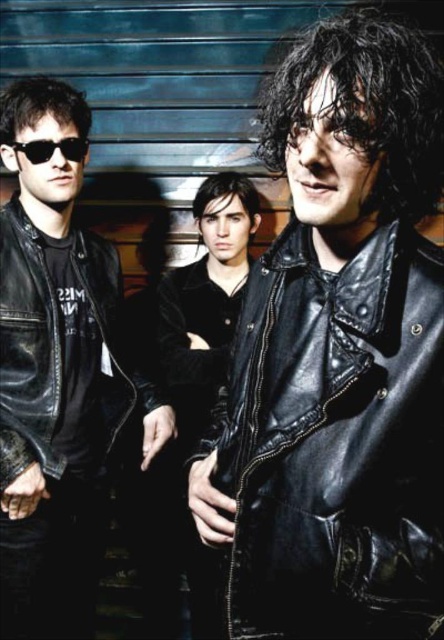
Does shiny black leather jacket at center have a lesser height compared to matte black leather jacket at left?

Yes.

In the scene shown: Which of these two, shiny black leather jacket at center or matte black leather jacket at left, stands shorter?

Standing shorter between the two is shiny black leather jacket at center.

Is point (400, 486) in front of point (47, 588)?

Yes, it is in front of point (47, 588).

You are a GUI agent. You are given a task and a screenshot of the screen. Output one action in this format:
    pyautogui.click(x=<x>, y=<y>)
    Task: Click on the shiny black leather jacket at center
    
    Given the screenshot: What is the action you would take?
    pyautogui.click(x=335, y=442)

Which of these two, shiny black leather jacket at center or black matte sunglasses at left, stands shorter?

With less height is black matte sunglasses at left.

Describe the element at coordinates (335, 442) in the screenshot. This screenshot has height=640, width=444. I see `shiny black leather jacket at center` at that location.

Locate an element on the screen. shiny black leather jacket at center is located at coordinates (335, 442).

Consider the image. Can you confirm if matte black leather jacket at left is bigger than black matte sunglasses at left?

Yes.

What do you see at coordinates (52, 371) in the screenshot? This screenshot has height=640, width=444. I see `matte black leather jacket at left` at bounding box center [52, 371].

Find the location of a particular element. This screenshot has width=444, height=640. matte black leather jacket at left is located at coordinates (52, 371).